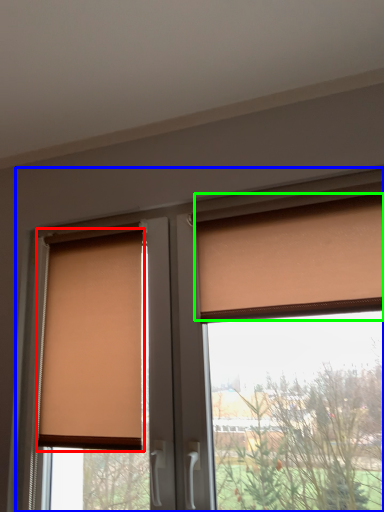
Question: Estimate the real-world distances between objects in this image. Which object is farther from window blind (highlighted by a red box), window (highlighted by a blue box) or curtain (highlighted by a green box)?

Choices:
 (A) window
 (B) curtain

Answer: (B)